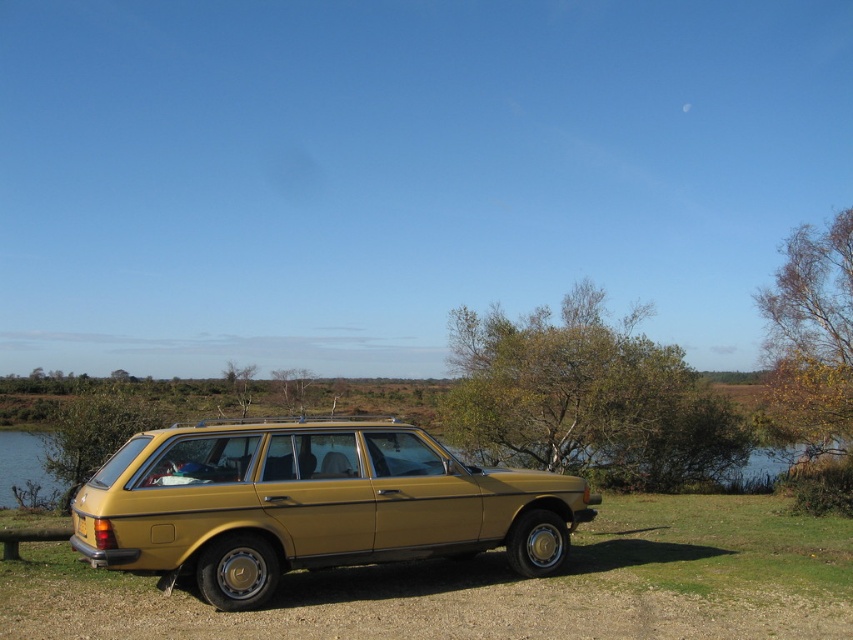
Question: Does green grass at center have a larger size compared to gold metallic station wagon at center?

Choices:
 (A) yes
 (B) no

Answer: (A)

Question: Which point is closer to the camera taking this photo?

Choices:
 (A) (329, 515)
 (B) (131, 593)
 (C) (665, 468)
 (D) (779, 305)

Answer: (A)

Question: Does green grass at center appear on the left side of green leafy tree at center?

Choices:
 (A) yes
 (B) no

Answer: (A)

Question: Can you confirm if gold metallic station wagon at center is positioned to the right of green leafy tree at center?

Choices:
 (A) no
 (B) yes

Answer: (A)

Question: Which object is the closest to the yellow-green leaves at upper right?

Choices:
 (A) green grass at center
 (B) gold metallic station wagon at center
 (C) green leafy tree at center

Answer: (C)

Question: Which of the following is the farthest from the observer?

Choices:
 (A) coord(433,616)
 (B) coord(520,356)
 (C) coord(489,529)
 (D) coord(802,332)

Answer: (D)